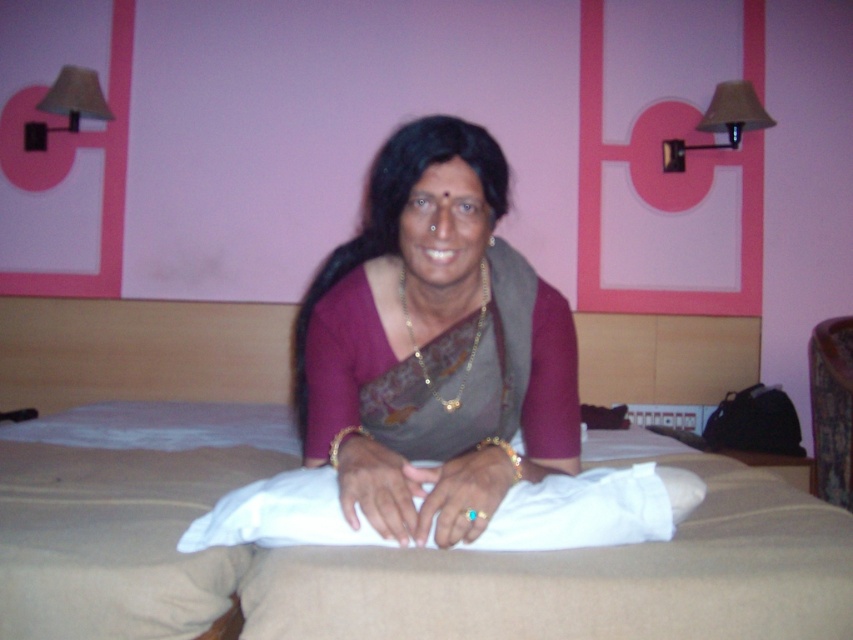
You are standing in the hotel room and want to move from one point to another. If you start at point (172,342) and want to reach point (389,461), will you be moving towards the bed or away from it?

Since point (172,342) is behind point (389,461), moving from the starting point to the destination means you are moving away from the bed.

You are a photographer standing in the hotel room and want to take a photo of the beige fabric bed at center. According to the coordinates provided, where should you position yourself to capture the bed in the center of your camera frame?

The beige fabric bed at center is located at coordinates point [397,563], so you should position yourself directly in front of that point to center it in your camera frame.

You are a photographer setting up a shoot in a hotel room. You need to place a 1.2 meter wide backdrop behind the beige fabric bed at center and the matte gray sari at center. Will the backdrop be wide enough to cover both objects?

The beige fabric bed at center is wider than the matte gray sari at center. Since the backdrop is 1.2 meters wide, it depends on the combined width of both objects. However, the description only states the bed is wider than the sari but does not provide exact measurements. Without knowing the exact widths, we cannot confirm if the backdrop will cover both.